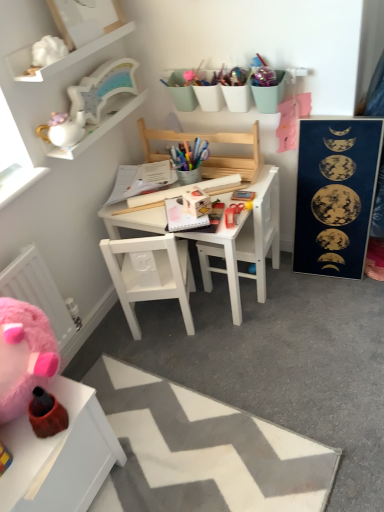
You are a GUI agent. You are given a task and a screenshot of the screen. Output one action in this format:
    pyautogui.click(x=<x>, y=<y>)
    Task: Click on the vacant point to the right of white wooden changing table at center
    The image size is (384, 512).
    Given the screenshot: What is the action you would take?
    pyautogui.click(x=294, y=282)